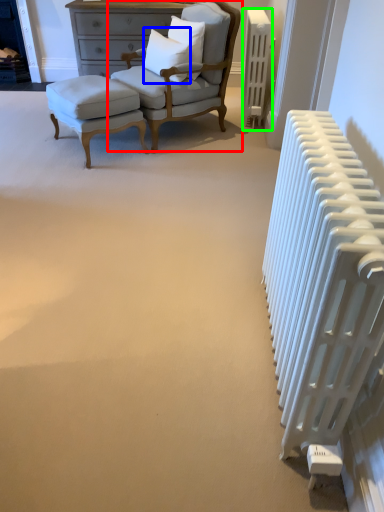
Question: Estimate the real-world distances between objects in this image. Which object is farther from chair (highlighted by a red box), pillow (highlighted by a blue box) or radiator (highlighted by a green box)?

Choices:
 (A) pillow
 (B) radiator

Answer: (B)